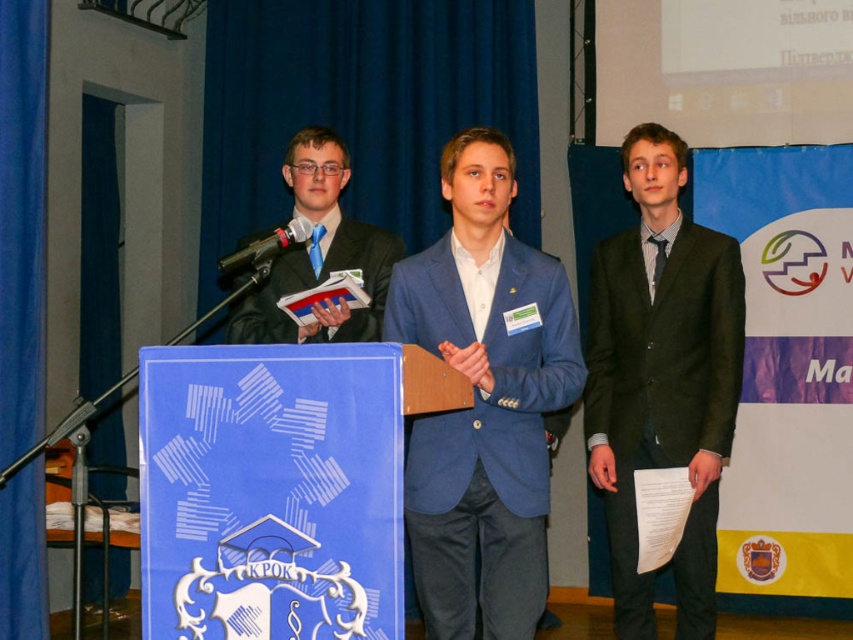
Question: Does blue textured suit at center appear over matte black suit at center?

Choices:
 (A) yes
 (B) no

Answer: (B)

Question: Based on their relative distances, which object is farther from the dark gray suit at right?

Choices:
 (A) black metallic microphone at center
 (B) blue textured suit at center

Answer: (A)

Question: Can you confirm if dark gray suit at right is positioned above blue textured suit at center?

Choices:
 (A) yes
 (B) no

Answer: (A)

Question: Among these objects, which one is farthest from the camera?

Choices:
 (A) dark gray suit at right
 (B) blue textured suit at center
 (C) black metallic microphone at center
 (D) matte black suit at center

Answer: (A)

Question: Does dark gray suit at right have a smaller size compared to blue textured suit at center?

Choices:
 (A) yes
 (B) no

Answer: (B)

Question: Which is nearer to the blue textured suit at center?

Choices:
 (A) dark gray suit at right
 (B) black metallic microphone at center

Answer: (B)